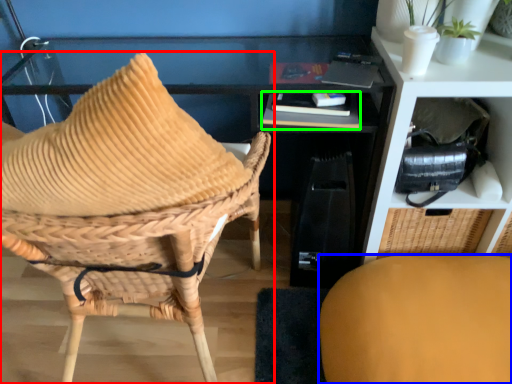
Question: Considering the real-world distances, which object is farthest from chair (highlighted by a red box)? chair (highlighted by a blue box) or book (highlighted by a green box)?

Choices:
 (A) chair
 (B) book

Answer: (A)